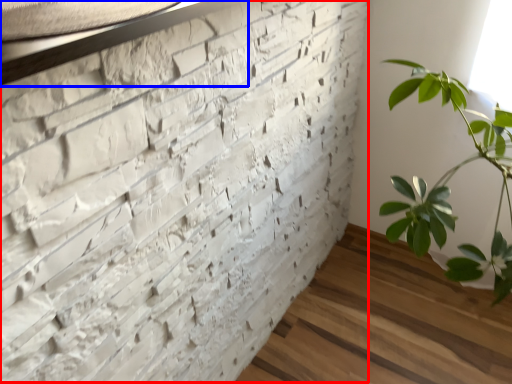
Question: Which of the following is the farthest to the observer, brickwork (highlighted by a red box) or window sill (highlighted by a blue box)?

Choices:
 (A) brickwork
 (B) window sill

Answer: (B)